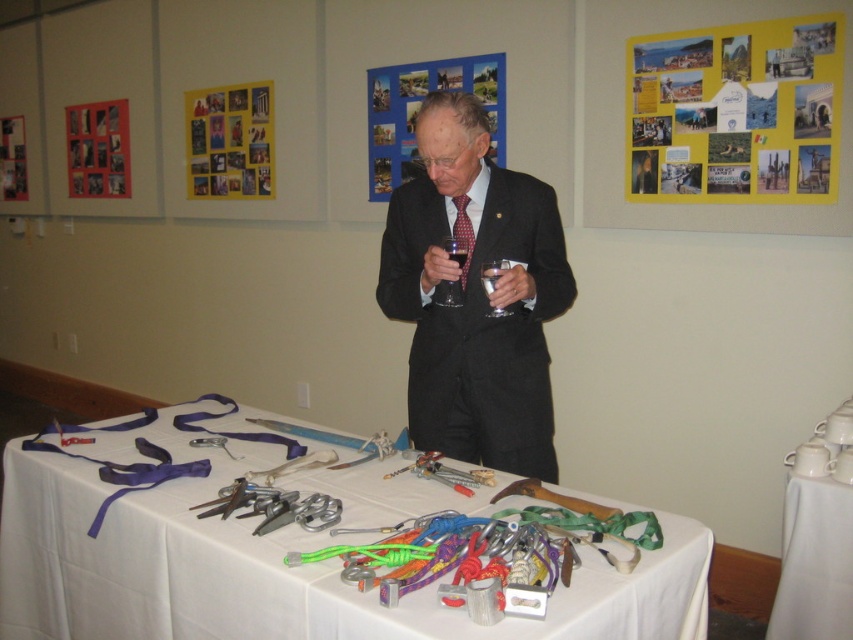
Image resolution: width=853 pixels, height=640 pixels. What do you see at coordinates (474, 296) in the screenshot?
I see `black matte suit at center` at bounding box center [474, 296].

Does point (416, 273) come in front of point (486, 266)?

That is False.

This screenshot has height=640, width=853. In order to click on black matte suit at center in this screenshot , I will do `click(474, 296)`.

Can you confirm if white fabric table at lower right is bigger than clear glass wine glass at center?

Indeed, white fabric table at lower right has a larger size compared to clear glass wine glass at center.

Which is in front, point (793, 540) or point (497, 308)?

Point (497, 308)

Measure the distance between white fabric table at lower right and camera.

The distance of white fabric table at lower right from camera is 1.87 meters.

Where is `white fabric table at lower right`? white fabric table at lower right is located at coordinates (817, 536).

Can you confirm if black matte suit at center is wider than transparent glass at center?

Correct, the width of black matte suit at center exceeds that of transparent glass at center.

The width and height of the screenshot is (853, 640). I want to click on black matte suit at center, so click(474, 296).